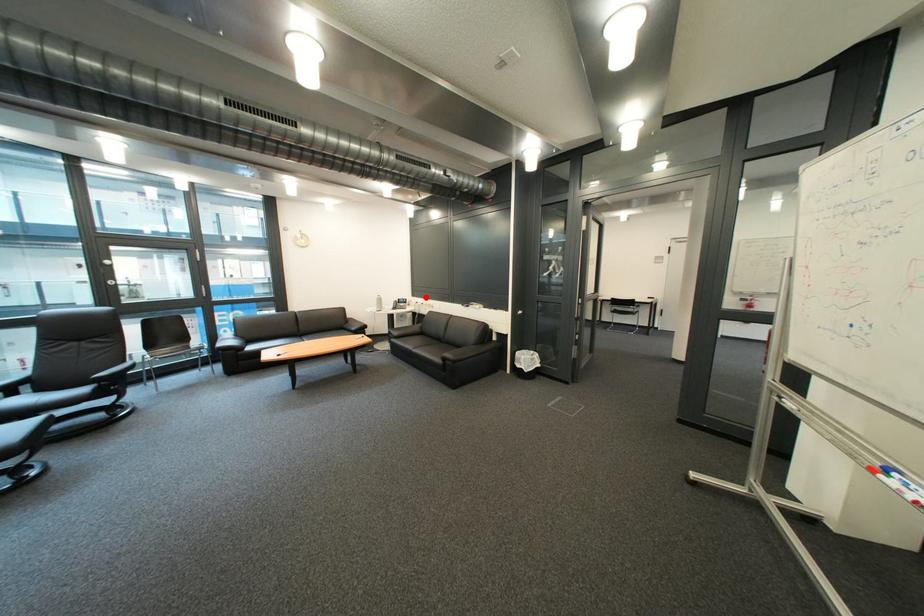
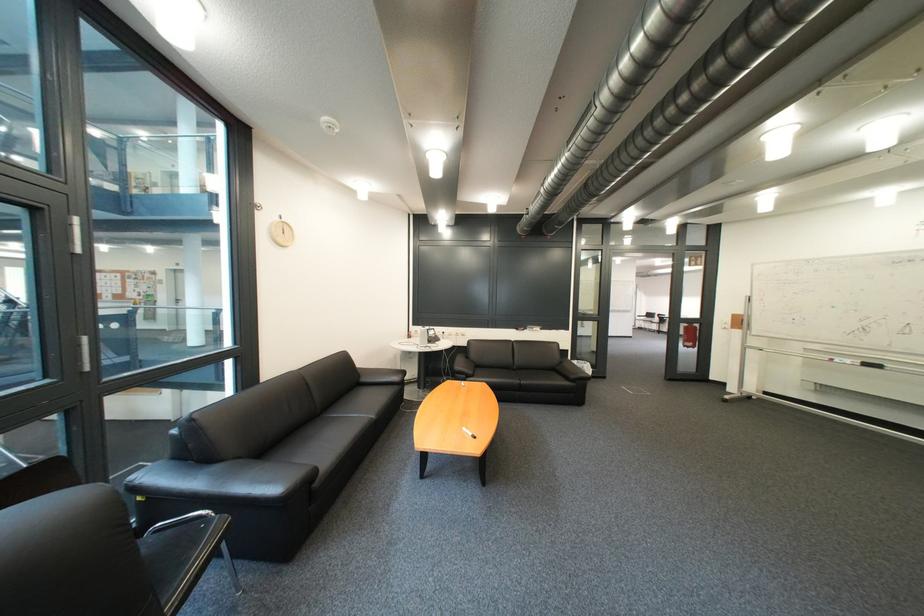
Question: I am providing you with two images of the same scene from different viewpoints. In image1, a red point is highlighted. Considering the same 3D point in image2, which of the following is correct?

Choices:
 (A) It is closer
 (B) It is farther

Answer: (B)